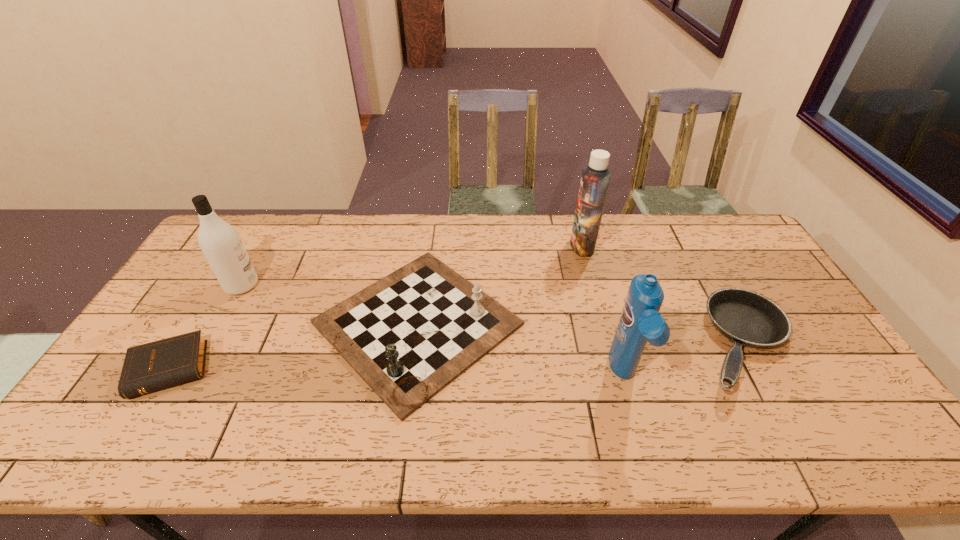
What are the coordinates of `vacant area in the image that satisfies the following two spatial constraints: 1. on the front label of the farthest shampoo; 2. on the front side of the third shortest object` in the screenshot? It's located at (603, 324).